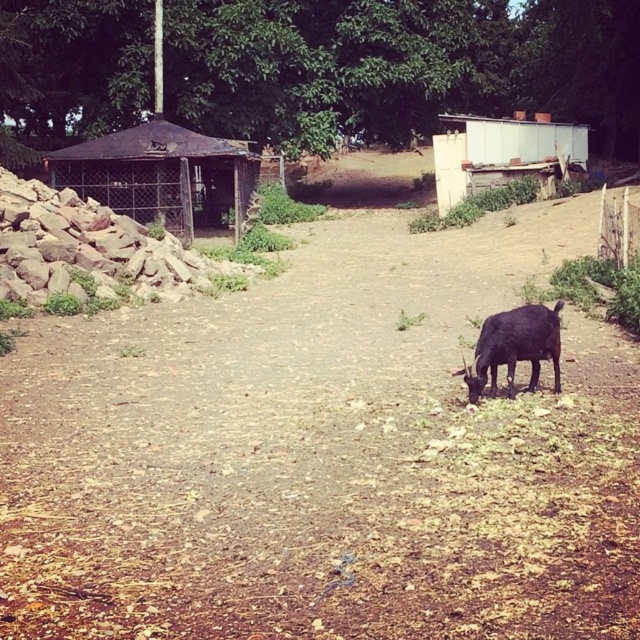
You are driving a tractor that is 2.5 meters wide. You want to move from the brown dirt track at center to the white corrugated metal hut at upper right. Is there enough space between them for your tractor to pass through?

The distance between the brown dirt track at center and white corrugated metal hut at upper right is 21.80 meters. Since the tractor is only 2.5 meters wide, there is ample space for it to pass through the 21.80 meters gap between them.

You are a hiker trying to find the shortest path to the white building in the background. You see the brown dirt track at center and the black matte goat at lower right. Which object should you prioritize following to reach the white building faster?

The brown dirt track at center is in front of the black matte goat at lower right, so following the brown dirt track at center would likely lead you closer to the white building faster since it is positioned closer to the foreground and possibly aligned towards the destination.